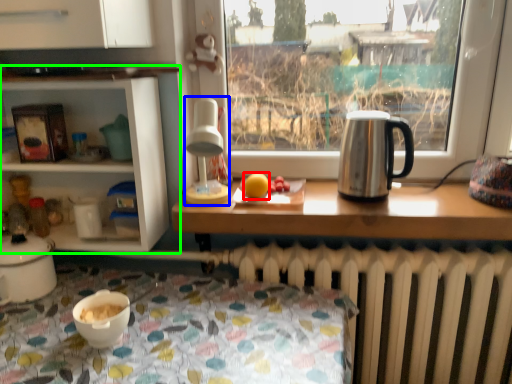
Question: Which object is the closest to the orange (highlighted by a red box)? Choose among these: lamp (highlighted by a blue box) or shelf (highlighted by a green box).

Choices:
 (A) lamp
 (B) shelf

Answer: (A)